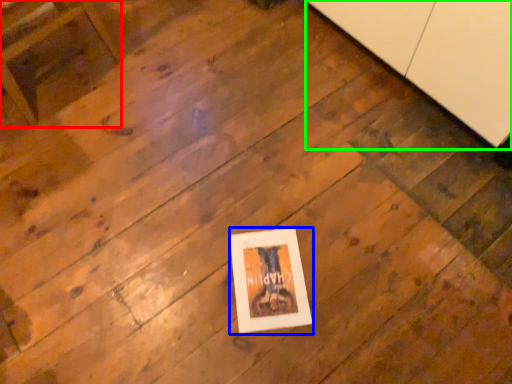
Question: Based on their relative distances, which object is farther from furniture (highlighted by a red box)? Choose from picture frame (highlighted by a blue box) and cabinetry (highlighted by a green box).

Choices:
 (A) picture frame
 (B) cabinetry

Answer: (B)